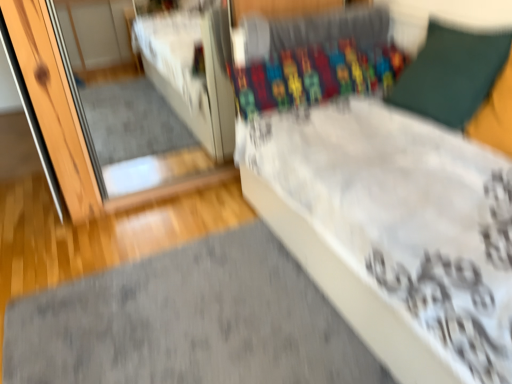
Question: From a real-world perspective, does green fabric pillow at upper right sit lower than white glossy mirror at upper left?

Choices:
 (A) yes
 (B) no

Answer: (B)

Question: Is white glossy mirror at upper left at the back of green fabric pillow at upper right?

Choices:
 (A) no
 (B) yes

Answer: (A)

Question: Considering the relative sizes of green fabric pillow at upper right and white glossy mirror at upper left in the image provided, is green fabric pillow at upper right thinner than white glossy mirror at upper left?

Choices:
 (A) no
 (B) yes

Answer: (B)

Question: Considering the relative sizes of green fabric pillow at upper right and white glossy mirror at upper left in the image provided, is green fabric pillow at upper right taller than white glossy mirror at upper left?

Choices:
 (A) no
 (B) yes

Answer: (A)

Question: Is green fabric pillow at upper right closer to camera compared to white glossy mirror at upper left?

Choices:
 (A) yes
 (B) no

Answer: (A)

Question: Can you confirm if green fabric pillow at upper right is shorter than white glossy mirror at upper left?

Choices:
 (A) yes
 (B) no

Answer: (A)

Question: Can you confirm if white glossy mirror at upper left is bigger than green fabric pillow at upper right?

Choices:
 (A) yes
 (B) no

Answer: (A)

Question: Can you confirm if white glossy mirror at upper left is positioned to the right of green fabric pillow at upper right?

Choices:
 (A) no
 (B) yes

Answer: (A)

Question: From a real-world perspective, does white glossy mirror at upper left sit lower than green fabric pillow at upper right?

Choices:
 (A) yes
 (B) no

Answer: (A)

Question: Is white glossy mirror at upper left thinner than green fabric pillow at upper right?

Choices:
 (A) yes
 (B) no

Answer: (B)

Question: Does white glossy mirror at upper left come behind green fabric pillow at upper right?

Choices:
 (A) no
 (B) yes

Answer: (B)

Question: Can you confirm if white glossy mirror at upper left is taller than green fabric pillow at upper right?

Choices:
 (A) yes
 (B) no

Answer: (A)

Question: Is white glossy mirror at upper left further to the viewer compared to gray soft mat at lower left?

Choices:
 (A) yes
 (B) no

Answer: (A)